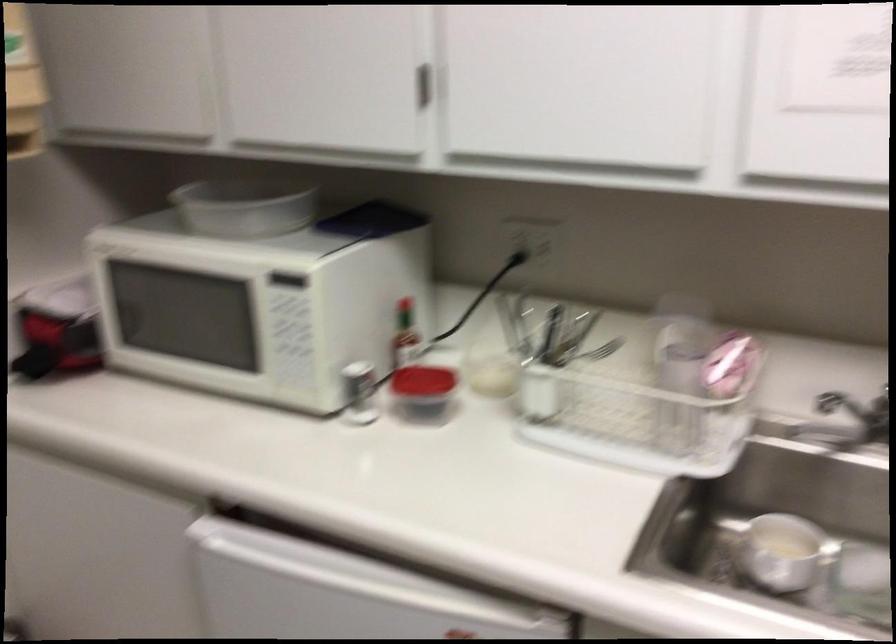
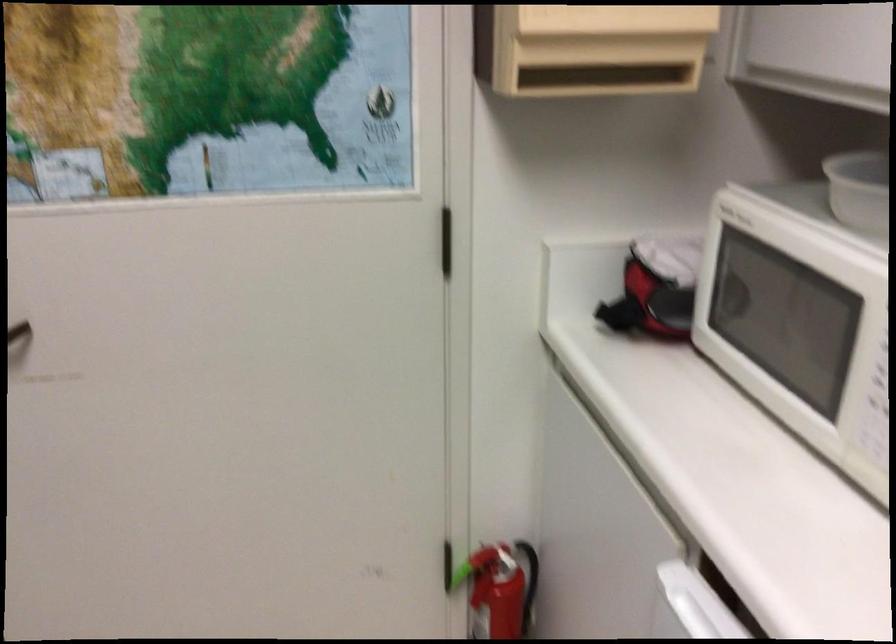
In the second image, find the point that corresponds to [82,526] in the first image.

(591, 489)